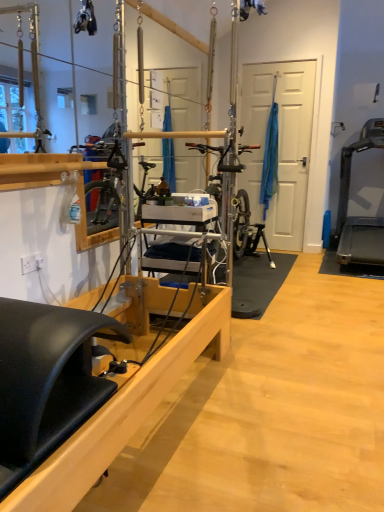
Where is `wooden pilates reformer at center`? wooden pilates reformer at center is located at coordinates (81, 394).

The height and width of the screenshot is (512, 384). Describe the element at coordinates (81, 394) in the screenshot. I see `wooden pilates reformer at center` at that location.

Measure the distance between wooden pilates reformer at center and camera.

wooden pilates reformer at center is 88.77 centimeters away from camera.

What is the approximate width of wooden pilates reformer at center?

5.00 meters.

Measure the distance between point (x=28, y=364) and camera.

Point (x=28, y=364) is 3.30 feet away from camera.

Looking at this image, in order to face wooden pilates reformer at center, should I rotate leftwards or rightwards?

You should look right and rotate roughly 11.654 degrees.

Image resolution: width=384 pixels, height=512 pixels. In order to click on black plastic treadmill at right in this screenshot , I will do `click(359, 217)`.

What do you see at coordinates (359, 217) in the screenshot?
I see `black plastic treadmill at right` at bounding box center [359, 217].

What is the approximate height of black plastic treadmill at right?

The height of black plastic treadmill at right is 1.48 meters.

You are a GUI agent. You are given a task and a screenshot of the screen. Output one action in this format:
    pyautogui.click(x=<x>, y=<y>)
    Task: Click on the wooden pilates reformer at center
    
    Given the screenshot: What is the action you would take?
    pyautogui.click(x=81, y=394)

Visually, is wooden pilates reformer at center positioned to the left or to the right of black plastic treadmill at right?

wooden pilates reformer at center is to the left of black plastic treadmill at right.

In the scene shown: Does wooden pilates reformer at center come in front of black plastic treadmill at right?

Yes, wooden pilates reformer at center is closer to the viewer.

Which is farther from the camera, (64, 459) or (354, 261)?

The point (354, 261) is more distant.

From the image's perspective, is wooden pilates reformer at center located beneath black plastic treadmill at right?

Indeed, from the image's perspective, wooden pilates reformer at center is shown beneath black plastic treadmill at right.

From a real-world perspective, is wooden pilates reformer at center physically below black plastic treadmill at right?

Yes, from a real-world perspective, wooden pilates reformer at center is beneath black plastic treadmill at right.

Considering the sizes of objects wooden pilates reformer at center and black plastic treadmill at right in the image provided, who is thinner, wooden pilates reformer at center or black plastic treadmill at right?

black plastic treadmill at right.

Considering the relative sizes of wooden pilates reformer at center and black plastic treadmill at right in the image provided, is wooden pilates reformer at center taller than black plastic treadmill at right?

Incorrect, the height of wooden pilates reformer at center is not larger of that of black plastic treadmill at right.

Which of these two, wooden pilates reformer at center or black plastic treadmill at right, is bigger?

black plastic treadmill at right is bigger.

Is black plastic treadmill at right located within wooden pilates reformer at center?

No, black plastic treadmill at right is not inside wooden pilates reformer at center.

Is the surface of wooden pilates reformer at center in direct contact with black plastic treadmill at right?

wooden pilates reformer at center is not next to black plastic treadmill at right, and they're not touching.

Is wooden pilates reformer at center facing towards black plastic treadmill at right?

No, wooden pilates reformer at center is not aimed at black plastic treadmill at right.

How much distance is there between wooden pilates reformer at center and black plastic treadmill at right?

The distance of wooden pilates reformer at center from black plastic treadmill at right is 9.13 feet.

You are a GUI agent. You are given a task and a screenshot of the screen. Output one action in this format:
    pyautogui.click(x=<x>, y=<y>)
    Task: Click on the treadmill lying above the wooden pilates reformer at center (from the image's perspective)
    The width and height of the screenshot is (384, 512).
    Given the screenshot: What is the action you would take?
    pyautogui.click(x=359, y=217)

In the scene shown: Which object is positioned more to the right, black plastic treadmill at right or wooden pilates reformer at center?

From the viewer's perspective, black plastic treadmill at right appears more on the right side.

Is black plastic treadmill at right positioned behind wooden pilates reformer at center?

Yes, black plastic treadmill at right is further from the camera.

Which is less distant, [382,231] or [61,383]?

Point [382,231] is positioned farther from the camera compared to point [61,383].

From the image's perspective, is black plastic treadmill at right below wooden pilates reformer at center?

No, from the image's perspective, black plastic treadmill at right is not beneath wooden pilates reformer at center.

From a real-world perspective, is black plastic treadmill at right physically located above or below wooden pilates reformer at center?

Clearly, from a real-world perspective, black plastic treadmill at right is above wooden pilates reformer at center.

Looking at this image, considering the sizes of objects black plastic treadmill at right and wooden pilates reformer at center in the image provided, who is thinner, black plastic treadmill at right or wooden pilates reformer at center?

Thinner between the two is black plastic treadmill at right.

Is black plastic treadmill at right taller or shorter than wooden pilates reformer at center?

In the image, black plastic treadmill at right appears to be taller than wooden pilates reformer at center.

Looking at this image, who is smaller, black plastic treadmill at right or wooden pilates reformer at center?

With smaller size is wooden pilates reformer at center.

Choose the correct answer: Is black plastic treadmill at right inside wooden pilates reformer at center or outside it?

black plastic treadmill at right is not inside wooden pilates reformer at center, it's outside.

Is black plastic treadmill at right not near wooden pilates reformer at center?

Yes, black plastic treadmill at right and wooden pilates reformer at center are quite far apart.

Is black plastic treadmill at right turned away from wooden pilates reformer at center?

black plastic treadmill at right is not turned away from wooden pilates reformer at center.

I want to click on furniture lying on the left of black plastic treadmill at right, so click(x=81, y=394).

The height and width of the screenshot is (512, 384). What are the coordinates of `treadmill above the wooden pilates reformer at center (from a real-world perspective)` in the screenshot? It's located at (359, 217).

The height and width of the screenshot is (512, 384). In order to click on furniture that is in front of the black plastic treadmill at right in this screenshot , I will do `click(81, 394)`.